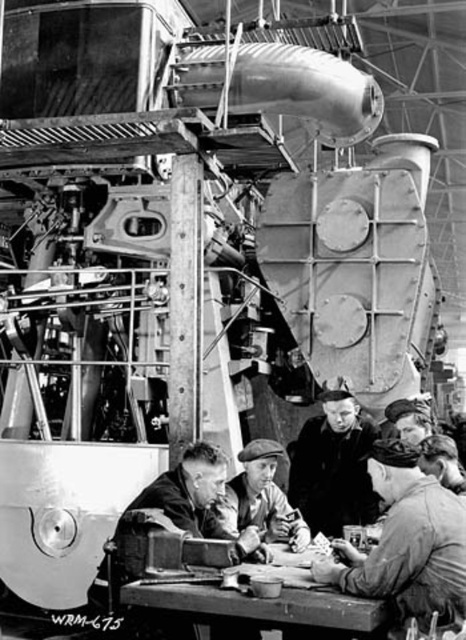
Is point (297, 618) behind point (260, 525)?

No, (297, 618) is in front of (260, 525).

Which is below, smooth wooden table at center or light brown leather cap at center?

smooth wooden table at center is below.

Which is behind, point (253, 611) or point (274, 509)?

The point (274, 509) is behind.

Find the location of `smooth wooden table at center`. smooth wooden table at center is located at coordinates (265, 605).

Who is more forward, (330, 412) or (266, 474)?

Point (266, 474) is in front.

From the picture: Can you confirm if dark fabric cap at center is wider than light brown leather cap at center?

Correct, the width of dark fabric cap at center exceeds that of light brown leather cap at center.

The image size is (466, 640). What do you see at coordinates (333, 467) in the screenshot?
I see `dark fabric cap at center` at bounding box center [333, 467].

At what (x,y) coordinates should I click in order to perform the action: click on dark fabric cap at center. Please return your answer as a coordinate pair (x, y). Looking at the image, I should click on (333, 467).

Does dark gray uniform at center lie behind dark fabric cap at center?

No, dark gray uniform at center is in front of dark fabric cap at center.

Does point (408, 557) come in front of point (328, 476)?

Yes, point (408, 557) is in front of point (328, 476).

I want to click on dark gray uniform at center, so click(406, 541).